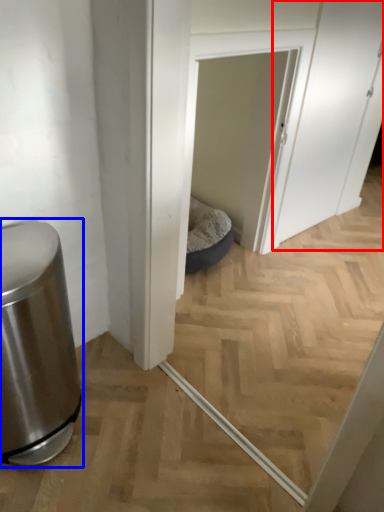
Question: Which point is closer to the camera, screen door (highlighted by a red box) or waste container (highlighted by a blue box)?

Choices:
 (A) screen door
 (B) waste container

Answer: (B)